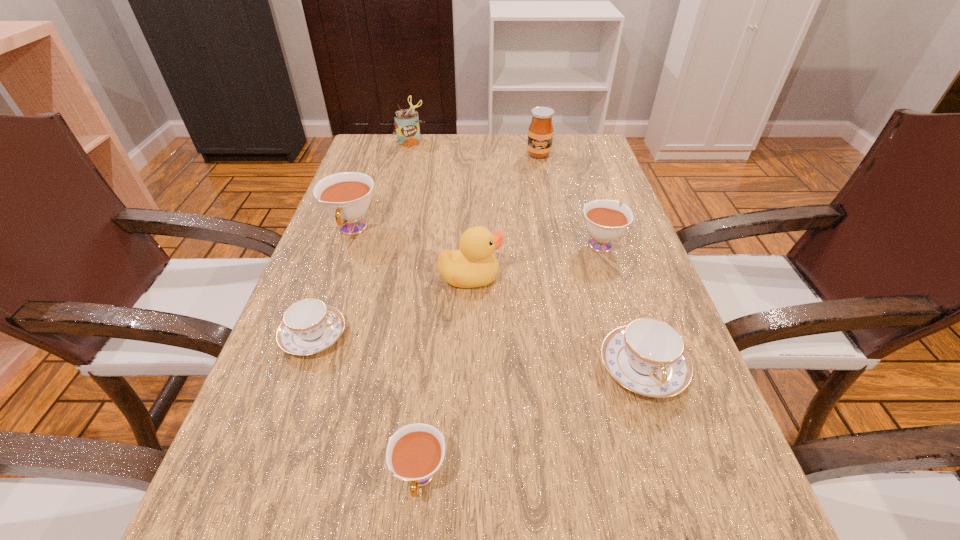
This screenshot has width=960, height=540. Identify the location of the second white teacup from left to right. (414, 453).

At what (x,y) coordinates should I click in order to perform the action: click on the left blue teacup. Please return your answer as a coordinate pair (x, y). Looking at the image, I should click on (309, 326).

I want to click on vacant area situated on the front of the can, so click(x=399, y=183).

You are a GUI agent. You are given a task and a screenshot of the screen. Output one action in this format:
    pyautogui.click(x=<x>, y=<y>)
    Task: Click on the free space located 0.320m on the front-facing side of the honey
    This screenshot has width=960, height=540.
    Given the screenshot: What is the action you would take?
    pyautogui.click(x=553, y=226)

The height and width of the screenshot is (540, 960). Identify the location of vacant point located at the beak of the duck. (640, 277).

This screenshot has width=960, height=540. Identify the location of free location located 0.330m on the side of the biggest white teacup with the handle. (302, 372).

Locate an element on the screen. vacant space located on the side of the second smallest white teacup with the handle is located at coordinates (587, 202).

I want to click on free space located 0.230m on the side of the second smallest white teacup with the handle, so click(x=579, y=178).

Where is `free space located 0.400m on the side of the second smallest white teacup with the handle`? This screenshot has width=960, height=540. free space located 0.400m on the side of the second smallest white teacup with the handle is located at coordinates (570, 149).

The height and width of the screenshot is (540, 960). In order to click on vacant space located on the side with the handle of the bigger blue teacup in this screenshot , I will do `click(673, 463)`.